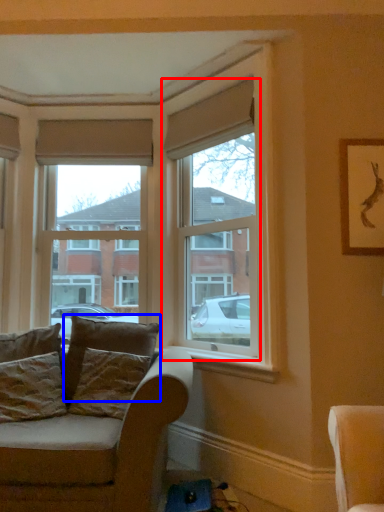
Question: Which object is further to the camera taking this photo, window (highlighted by a red box) or pillow (highlighted by a blue box)?

Choices:
 (A) window
 (B) pillow

Answer: (B)